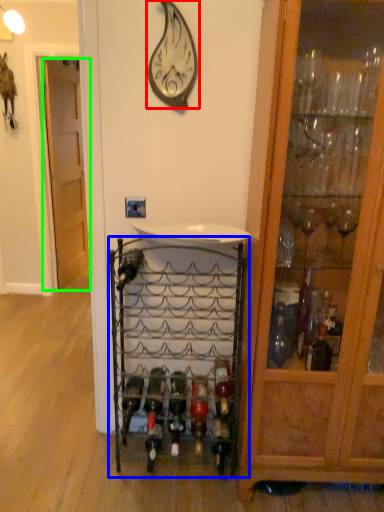
Question: Which is farther away from wall clock (highlighted by a red box)? shelf (highlighted by a blue box) or door (highlighted by a green box)?

Choices:
 (A) shelf
 (B) door

Answer: (B)